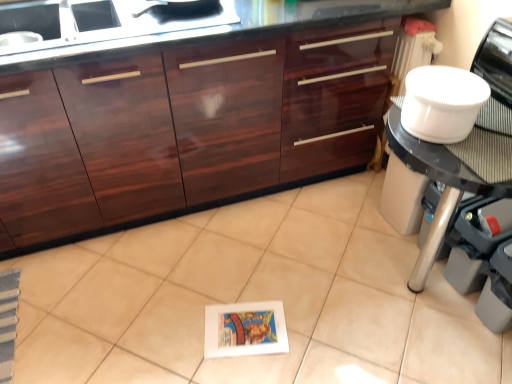
Identify the location of vacant region in front of white paper book at center. Image resolution: width=512 pixels, height=384 pixels. (248, 369).